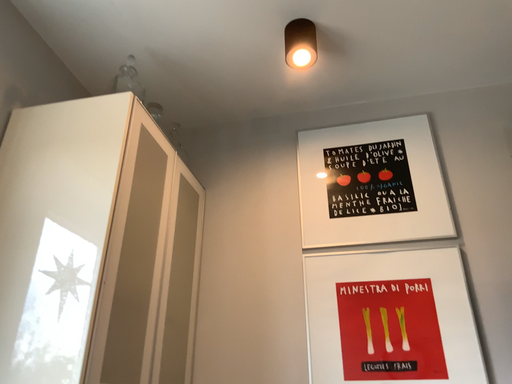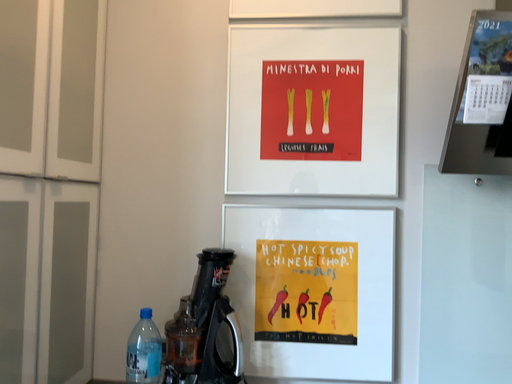
Question: Which way did the camera rotate in the video?

Choices:
 (A) rotated upward
 (B) rotated downward

Answer: (B)